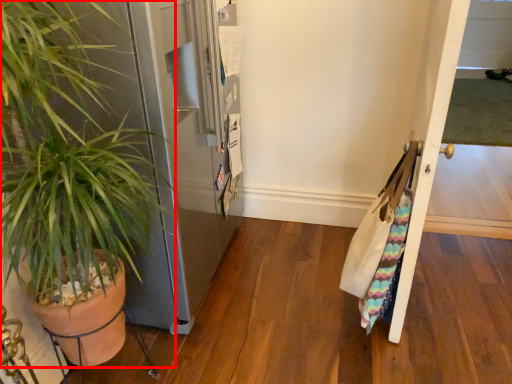
Question: From the image's perspective, what is the correct spatial positioning of houseplant (annotated by the red box) in reference to door?

Choices:
 (A) above
 (B) below

Answer: (B)